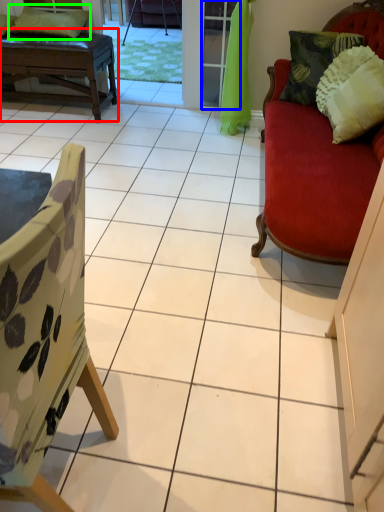
Question: Which is farther away from table (highlighted by a red box)? screen door (highlighted by a blue box) or pillow (highlighted by a green box)?

Choices:
 (A) screen door
 (B) pillow

Answer: (A)